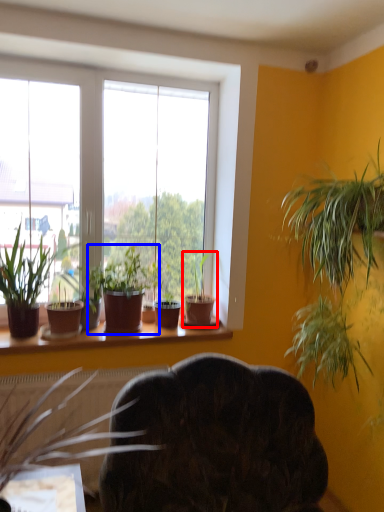
Question: Which of the following is the closest to the observer, houseplant (highlighted by a red box) or houseplant (highlighted by a blue box)?

Choices:
 (A) houseplant
 (B) houseplant

Answer: (B)